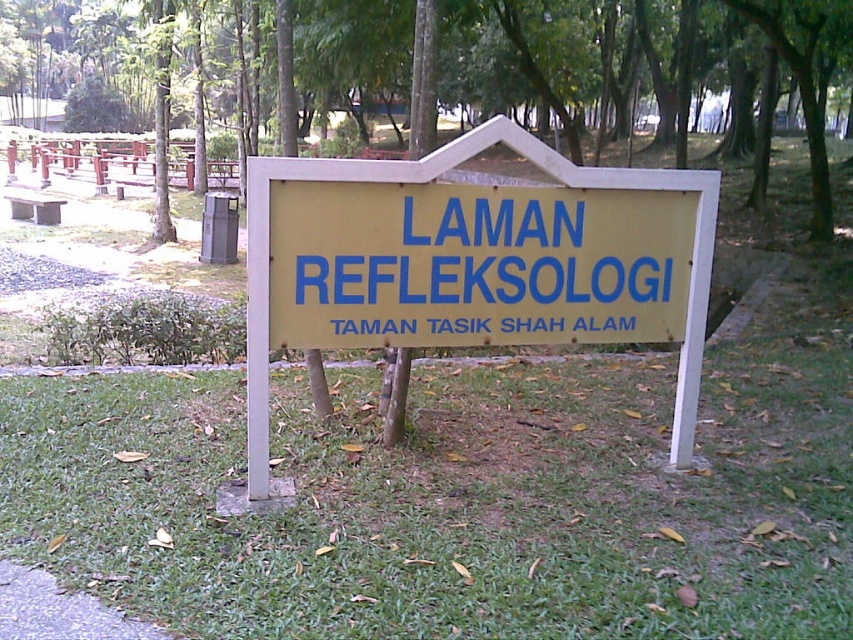
Is green grass at center in front of yellow matte signboard at center?

Yes, it is in front of yellow matte signboard at center.

Measure the distance from green grass at center to yellow matte signboard at center.

39.30 inches

What do you see at coordinates (454, 502) in the screenshot? This screenshot has width=853, height=640. I see `green grass at center` at bounding box center [454, 502].

Where is `green grass at center`? The image size is (853, 640). green grass at center is located at coordinates (454, 502).

Based on the photo, who is more forward, (433, 371) or (254, 307)?

Point (254, 307) is more forward.

Locate an element on the screen. This screenshot has height=640, width=853. green grass at center is located at coordinates coord(454,502).

This screenshot has height=640, width=853. Find the location of `green grass at center`. green grass at center is located at coordinates 454,502.

Is yellow matte sign at center taller than yellow matte signboard at center?

Indeed, yellow matte sign at center has a greater height compared to yellow matte signboard at center.

Locate an element on the screen. Image resolution: width=853 pixels, height=640 pixels. yellow matte sign at center is located at coordinates (457, 264).

Locate an element on the screen. The width and height of the screenshot is (853, 640). yellow matte sign at center is located at coordinates (457, 264).